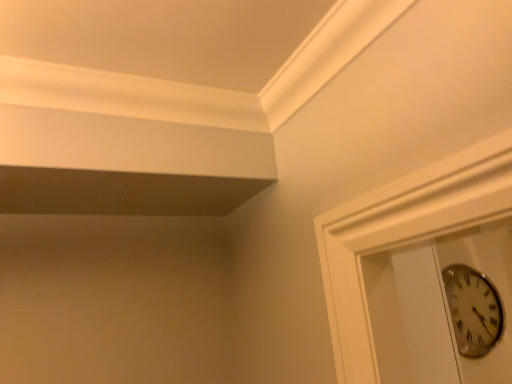
The height and width of the screenshot is (384, 512). Find the location of `metallic silver clock at right`. metallic silver clock at right is located at coordinates (473, 310).

Image resolution: width=512 pixels, height=384 pixels. Describe the element at coordinates (473, 310) in the screenshot. I see `metallic silver clock at right` at that location.

The height and width of the screenshot is (384, 512). Identify the location of metallic silver clock at right. (473, 310).